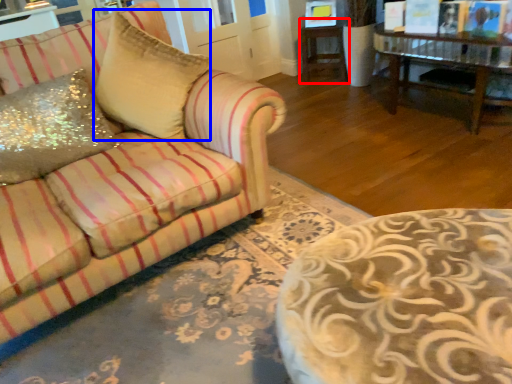
Question: Among these objects, which one is farthest to the camera, side table (highlighted by a red box) or throw pillow (highlighted by a blue box)?

Choices:
 (A) side table
 (B) throw pillow

Answer: (A)